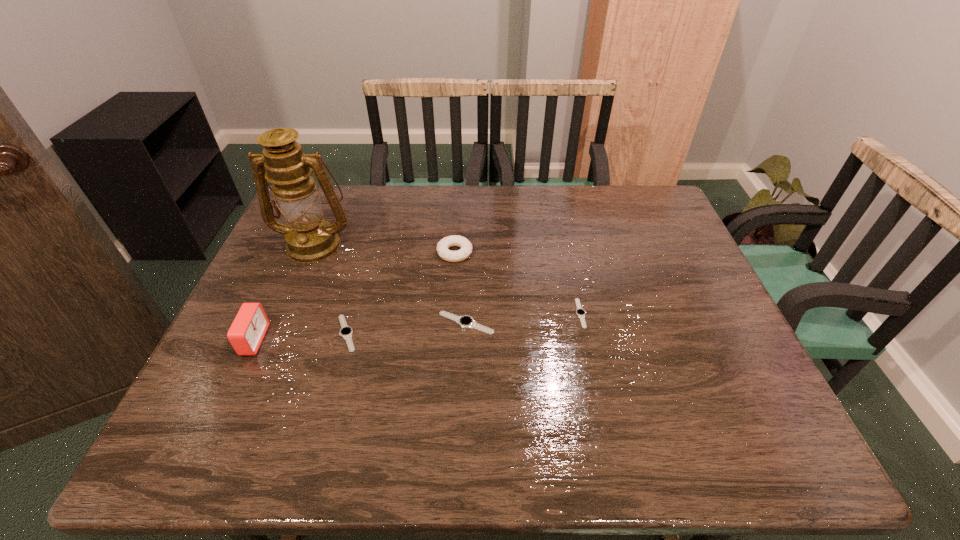
Where is `the second tallest watch`? the second tallest watch is located at coordinates (346, 332).

This screenshot has width=960, height=540. I want to click on the second shortest object, so click(x=346, y=332).

Where is `the second watch from left to right`? The height and width of the screenshot is (540, 960). the second watch from left to right is located at coordinates (466, 321).

The height and width of the screenshot is (540, 960). In order to click on the tallest watch in this screenshot , I will do `click(466, 321)`.

Locate an element on the screen. The image size is (960, 540). the rightmost object is located at coordinates (580, 312).

Identify the location of the shortest watch. This screenshot has height=540, width=960. (580, 312).

Where is `doughnut`? doughnut is located at coordinates (454, 240).

The image size is (960, 540). What are the coordinates of `the tallest object` in the screenshot? It's located at (309, 238).

This screenshot has width=960, height=540. I want to click on alarm clock, so click(x=248, y=329).

Find the location of a particular element. This screenshot has width=960, height=540. free space located on the back of the leftmost watch is located at coordinates (370, 251).